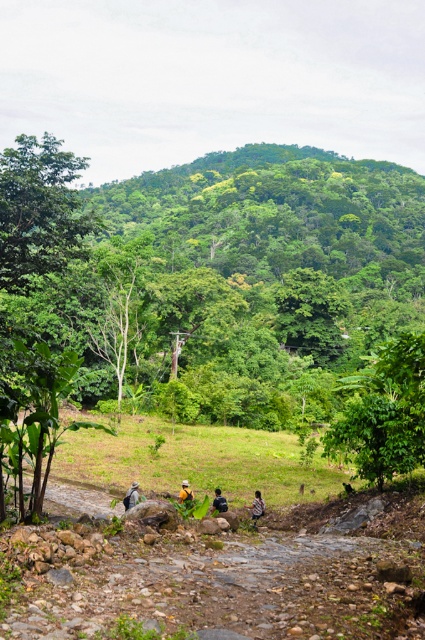
Question: In this image, where is green leafy tree at lower right located relative to yellow fabric shirt at center?

Choices:
 (A) below
 (B) above

Answer: (B)

Question: Which point appears closest to the camera in this image?

Choices:
 (A) pos(124,500)
 (B) pos(212,515)
 (C) pos(379,358)
 (D) pos(257,506)

Answer: (B)

Question: Is light brown fabric shirt at center positioned before yellow fabric shirt at center?

Choices:
 (A) yes
 (B) no

Answer: (B)

Question: Among these objects, which one is nearest to the camera?

Choices:
 (A) yellow fabric shirt at center
 (B) green leafy tree at lower right
 (C) green leafy tree at upper left
 (D) black fabric person at center

Answer: (A)

Question: Among these objects, which one is farthest from the camera?

Choices:
 (A) green leafy tree at upper left
 (B) striped shirt at lower center
 (C) black fabric person at center
 (D) green leafy tree at lower right

Answer: (B)

Question: Can you confirm if green leafy tree at lower right is positioned above black fabric person at center?

Choices:
 (A) yes
 (B) no

Answer: (A)